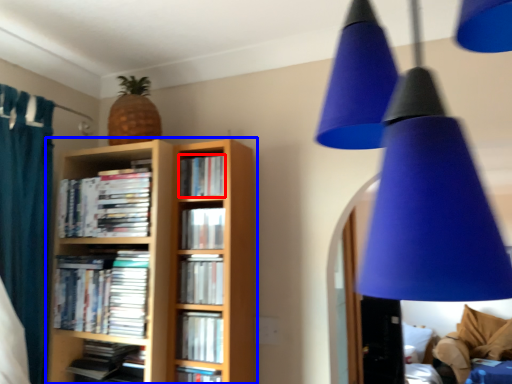
Question: Which object is further to the camera taking this photo, book (highlighted by a red box) or bookcase (highlighted by a blue box)?

Choices:
 (A) book
 (B) bookcase

Answer: (A)